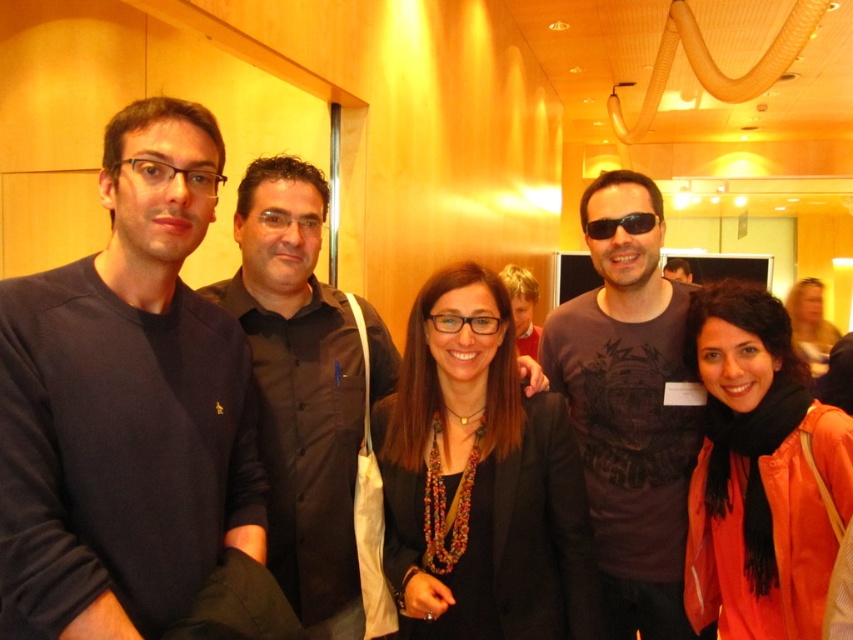
You are a photographer trying to adjust the lighting for a photo shoot. You notice the matte black blazer at center and the orange matte jacket at center. Which piece of clothing should you focus your lighting on to ensure it stands out against the other?

The matte black blazer at center is above the orange matte jacket at center, so focusing the lighting on the matte black blazer at center would make it stand out against the lower positioned orange matte jacket at center.

You are a photographer trying to adjust the lighting for a group photo. You notice the matte black blazer at center and the black plastic sunglasses at center. How far apart are these two items in centimeters?

The matte black blazer at center and the black plastic sunglasses at center are 70.49 centimeters apart from each other.

You are a photographer adjusting your camera settings to focus on the two jackets in the image. Which jacket should you focus on first if you want to capture both the matte black blazer at center and the orange matte jacket at center in sharp focus?

You should focus on the matte black blazer at center first because it is closer to the viewer than the orange matte jacket at center, ensuring both will be in focus when using proper depth of field.